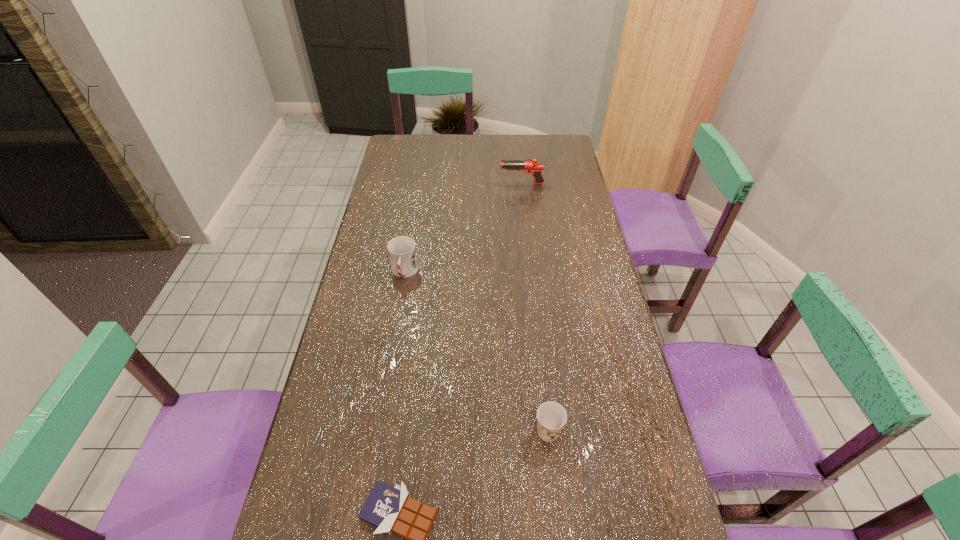
Identify the location of object located at the right edge. The width and height of the screenshot is (960, 540). (535, 168).

Identify the location of vacant area at the far edge of the desktop. (438, 145).

This screenshot has height=540, width=960. Find the location of `vacant region at the left edge of the desktop`. vacant region at the left edge of the desktop is located at coordinates (324, 522).

Identify the location of vacant position at the right edge of the desktop. Image resolution: width=960 pixels, height=540 pixels. (581, 191).

At what (x,y) coordinates should I click in order to perform the action: click on free point at the far left corner. Please return your answer as a coordinate pair (x, y). Looking at the image, I should click on (401, 134).

At what (x,y) coordinates should I click in order to perform the action: click on vacant space that's between the second shortest object and the third nearest object. Please return your answer as a coordinate pair (x, y). Image resolution: width=960 pixels, height=540 pixels. Looking at the image, I should click on point(476,352).

Find the location of a particular element. The image size is (960, 540). free area in between the third farthest object and the second farthest object is located at coordinates (476, 352).

Where is `free space between the Dixie cup and the cup`? Image resolution: width=960 pixels, height=540 pixels. free space between the Dixie cup and the cup is located at coordinates (476, 352).

The height and width of the screenshot is (540, 960). Identify the location of vacant region between the farthest object and the third tallest object. [535, 307].

This screenshot has width=960, height=540. Identify the location of vacant point located between the cup and the farthest object. (463, 228).